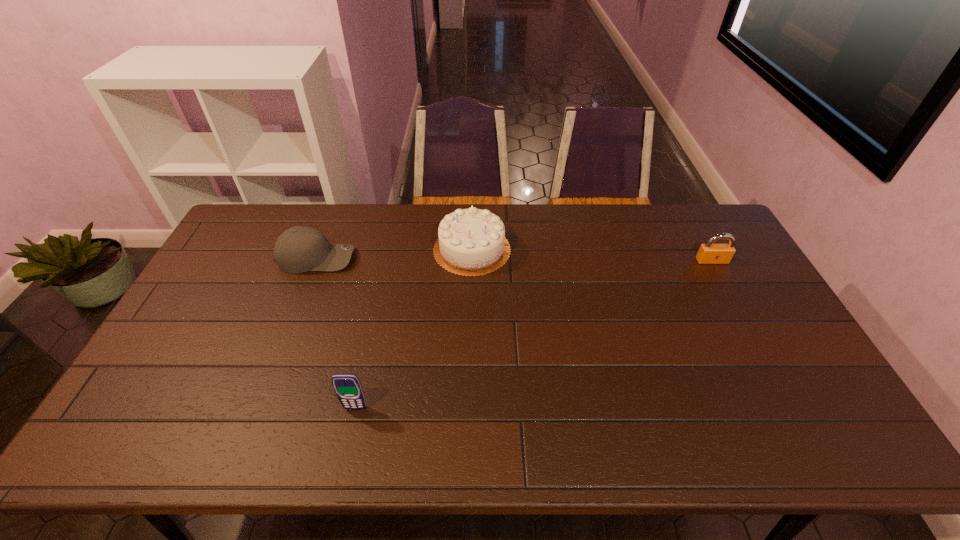
This screenshot has width=960, height=540. Find the location of `object located in the right edge section of the desktop`. object located in the right edge section of the desktop is located at coordinates (709, 253).

In the image, there is a desktop. Identify the location of vacant space at the far edge. This screenshot has height=540, width=960. (578, 240).

Where is `vacant space at the near edge of the desktop`? The height and width of the screenshot is (540, 960). vacant space at the near edge of the desktop is located at coordinates (528, 422).

You are a GUI agent. You are given a task and a screenshot of the screen. Output one action in this format:
    pyautogui.click(x=<x>, y=<y>)
    Task: Click on the free space at the left edge of the desktop
    This screenshot has width=960, height=540.
    Given the screenshot: What is the action you would take?
    pyautogui.click(x=229, y=259)

In the image, there is a desktop. Identify the location of free space at the right edge. This screenshot has width=960, height=540. (742, 275).

In the image, there is a desktop. At what (x,y) coordinates should I click in order to perform the action: click on vacant space at the far right corner. Please return your answer as a coordinate pair (x, y). This screenshot has width=960, height=540. Looking at the image, I should click on (688, 219).

Locate an element on the screen. vacant point located between the nearest object and the padlock is located at coordinates (534, 334).

You are a GUI agent. You are given a task and a screenshot of the screen. Output one action in this format:
    pyautogui.click(x=<x>, y=<y>)
    Task: Click on the vacant area that lies between the second object from right to left and the baseball cap
    
    Given the screenshot: What is the action you would take?
    pyautogui.click(x=395, y=254)

I want to click on empty location between the second object from right to left and the leftmost object, so click(x=395, y=254).

Locate an element on the screen. free spot between the padlock and the cellular telephone is located at coordinates (534, 334).